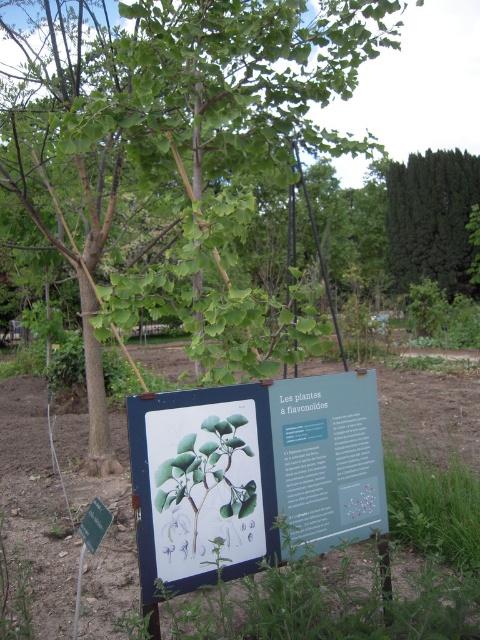
You are a botanist visiting the botanical garden and want to take a photo of the green leafy tree at center and the green paper sign at center. Which object should you focus on first if you want to capture both in a single frame without moving the camera?

The green leafy tree at center is larger in size than the green paper sign at center, so you should focus on the green leafy tree at center first to ensure it fits properly in the frame before adjusting for the smaller sign.

You are a visitor in the botanical garden and want to read the text on the green paper sign at center. However, the green leafy tree at center is blocking your view. Can you move around to see the sign clearly?

The green paper sign at center is behind the green leafy tree at center, so moving around might allow you to see the sign by going around the tree to get a clearer view.

Based on the botanical garden scene described, which tree is positioned higher up in the image, the green leafy tree at center or the dark green coniferous tree at upper right?

The green leafy tree at center is positioned higher up in the image than the dark green coniferous tree at upper right.